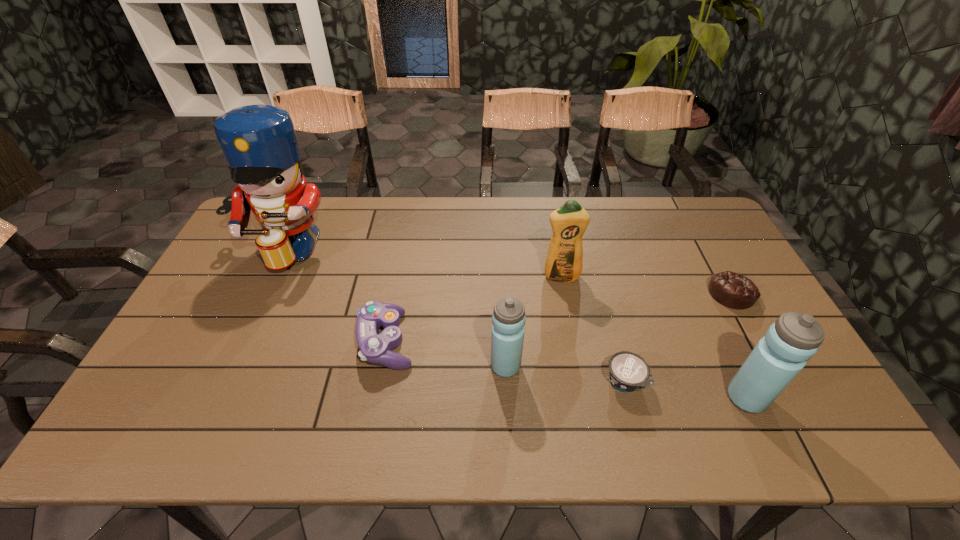
In the image, there is a desktop. Identify the location of vacant space at the far right corner. Image resolution: width=960 pixels, height=540 pixels. (688, 217).

What are the coordinates of `empty location between the yogurt and the nutcracker` in the screenshot? It's located at (454, 315).

Find the location of a particular element. This screenshot has width=960, height=540. vacant space that is in between the fifth object from left to right and the taller water bottle is located at coordinates (685, 389).

The width and height of the screenshot is (960, 540). What are the coordinates of `empty location between the shorter water bottle and the detergent` in the screenshot? It's located at (x=533, y=322).

Identify the location of blank region between the left water bottle and the beanbag. The height and width of the screenshot is (540, 960). (618, 330).

Find the location of `free space that is in between the fifth object from left to right and the beanbag`. free space that is in between the fifth object from left to right and the beanbag is located at coordinates (678, 337).

Find the location of a particular element. This screenshot has height=540, width=960. empty location between the right water bottle and the third object from right to left is located at coordinates (685, 389).

Find the location of `free spot between the nearer water bottle and the beanbag`. free spot between the nearer water bottle and the beanbag is located at coordinates (738, 346).

Image resolution: width=960 pixels, height=540 pixels. Find the location of `free space between the farther water bottle and the detergent`. free space between the farther water bottle and the detergent is located at coordinates (533, 322).

Select which object appears as the closest to the nutcracker. Please provide its 2D coordinates. Your answer should be formatted as a tuple, i.e. [(x, y)], where the tuple contains the x and y coordinates of a point satisfying the conditions above.

[(375, 348)]